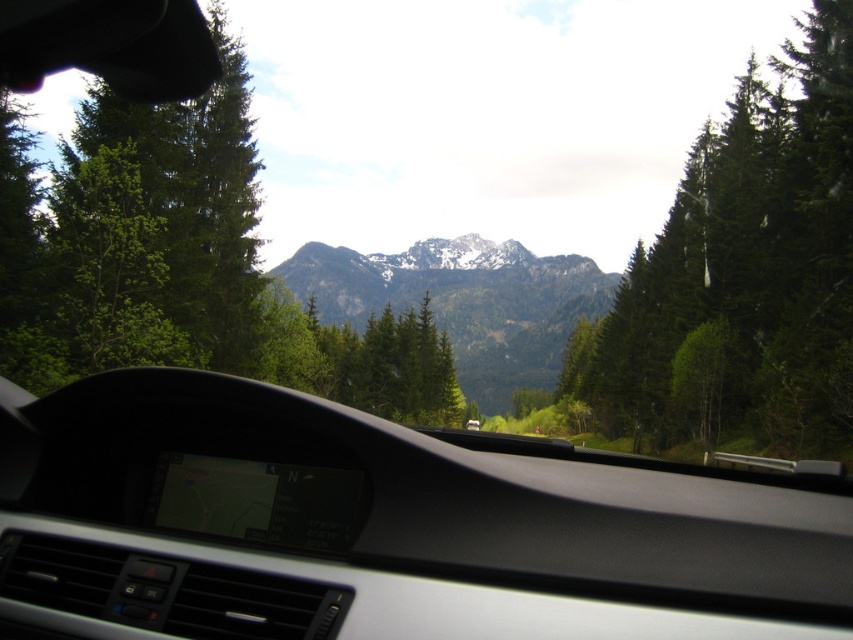
You are a passenger in the car and want to look through the windshield to see the mountains in the distance. Is the point at coordinate (x=381, y=528) on the windshield where you can see the mountains?

The point at coordinate (x=381, y=528) corresponds to the transparent glass windshield at center, so yes, you can see the mountains through that point on the windshield.

You are driving a car and looking at the windshield. There are two points marked on the windshield, one at point coordinates point (57, 269) and another at point coordinates point (509, 326). Which point is closer to you?

Point (57, 269) is in front of point (509, 326), so the point closer to you is point (57, 269).